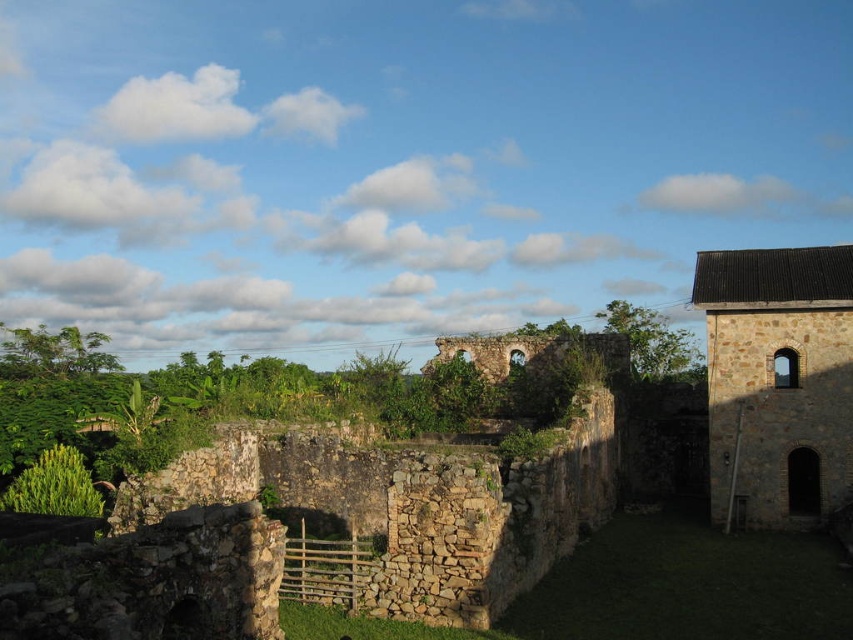
Question: Which of the following is the farthest from the observer?

Choices:
 (A) brown stone tower at right
 (B) green leafy bush at lower left

Answer: (A)

Question: Is brown stone tower at right to the right of green leafy bush at lower left from the viewer's perspective?

Choices:
 (A) yes
 (B) no

Answer: (A)

Question: Which object appears farthest from the camera in this image?

Choices:
 (A) green leafy bush at lower left
 (B) brown stone tower at right

Answer: (B)

Question: From the image, what is the correct spatial relationship of brown stone tower at right in relation to green leafy bush at lower left?

Choices:
 (A) right
 (B) left

Answer: (A)

Question: Can you confirm if brown stone tower at right is positioned above green leafy bush at lower left?

Choices:
 (A) no
 (B) yes

Answer: (B)